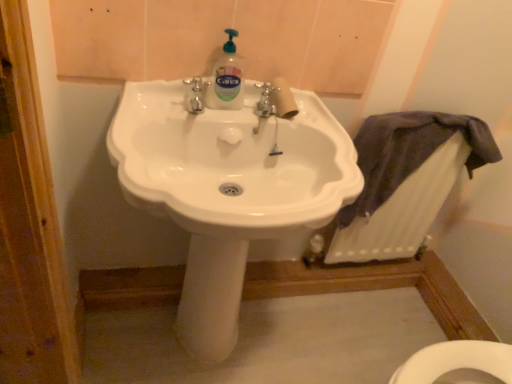
Question: From the image's perspective, is white glossy sink at center positioned above or below translucent plastic bottle at center?

Choices:
 (A) above
 (B) below

Answer: (B)

Question: Considering the positions of white glossy sink at center and translucent plastic bottle at center in the image, is white glossy sink at center wider or thinner than translucent plastic bottle at center?

Choices:
 (A) thin
 (B) wide

Answer: (B)

Question: Considering the real-world distances, which object is farthest from the white glossy sink at center?

Choices:
 (A) translucent plastic bottle at center
 (B) white textured radiator at lower right

Answer: (B)

Question: Estimate the real-world distances between objects in this image. Which object is closer to the white glossy sink at center?

Choices:
 (A) white textured radiator at lower right
 (B) translucent plastic bottle at center

Answer: (B)